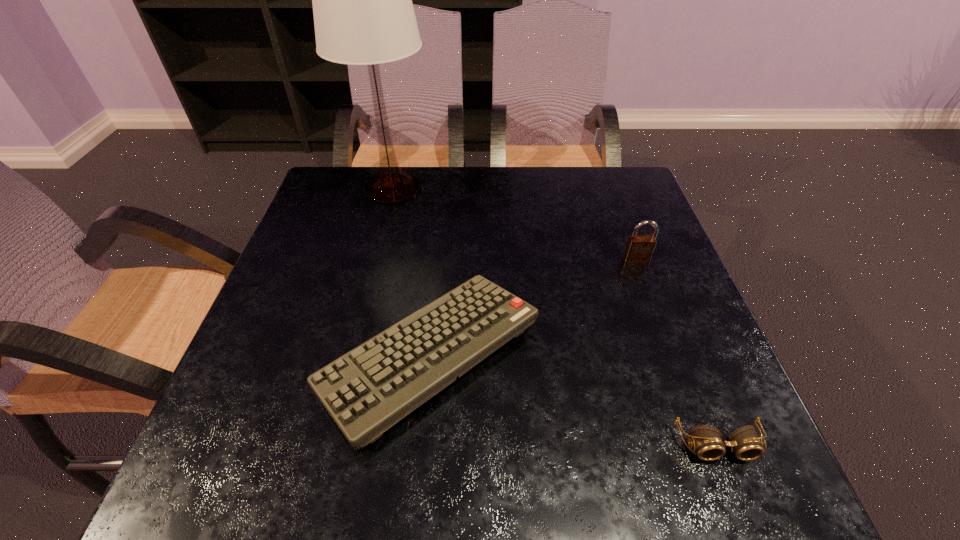
At what (x,y) coordinates should I click in order to perform the action: click on vacant area that lies between the farthest object and the goggles. Please return your answer as a coordinate pair (x, y). Looking at the image, I should click on (555, 316).

Locate an element on the screen. The height and width of the screenshot is (540, 960). unoccupied area between the goggles and the farthest object is located at coordinates (555, 316).

At what (x,y) coordinates should I click in order to perform the action: click on the closest object to the goggles. Please return your answer as a coordinate pair (x, y). The image size is (960, 540). Looking at the image, I should click on (366, 391).

This screenshot has height=540, width=960. Find the location of `object that is the third closest to the goggles`. object that is the third closest to the goggles is located at coordinates (363, 13).

Where is `free space that satisfies the following two spatial constraints: 1. above the cylindrical shade of the computer keyboard; 2. on the right side of the table lamp`? This screenshot has height=540, width=960. free space that satisfies the following two spatial constraints: 1. above the cylindrical shade of the computer keyboard; 2. on the right side of the table lamp is located at coordinates (351, 354).

The image size is (960, 540). I want to click on free space in the image that satisfies the following two spatial constraints: 1. above the cylindrical shade of the table lamp; 2. on the right side of the computer keyboard, so click(x=351, y=354).

Find the location of a particular element. This screenshot has height=540, width=960. free spot that satisfies the following two spatial constraints: 1. above the cylindrical shade of the computer keyboard; 2. on the left side of the tallest object is located at coordinates (351, 354).